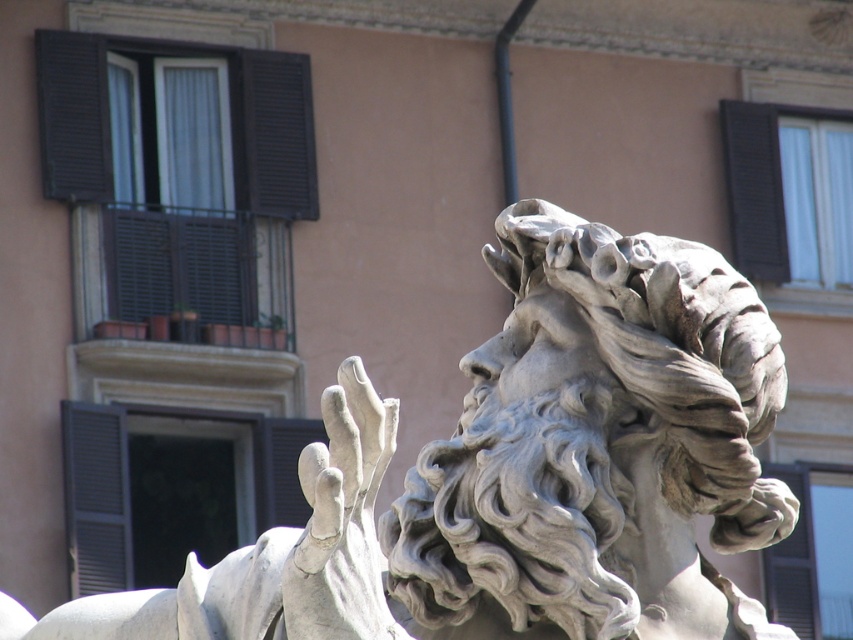
From the picture: Is white marble statue at upper center below black matte shutter at upper right?

Indeed, white marble statue at upper center is positioned under black matte shutter at upper right.

Which is in front, point (631, 296) or point (746, 225)?

Positioned in front is point (631, 296).

Identify the location of white marble statue at upper center. The height and width of the screenshot is (640, 853). (525, 472).